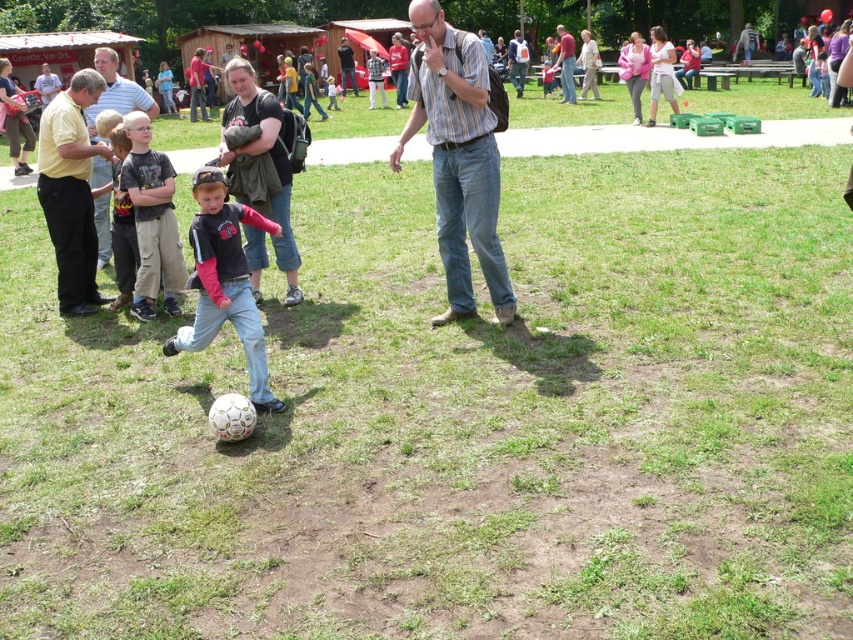
Question: Which point is closer to the camera taking this photo?

Choices:
 (A) (143, 108)
 (B) (236, 196)
 (C) (138, 129)

Answer: (C)

Question: Is dark gray cotton shirt at center above matte gray shirt at center?

Choices:
 (A) yes
 (B) no

Answer: (B)

Question: Estimate the real-world distances between objects in this image. Which object is farther from the matte gray shirt at center?

Choices:
 (A) matte black shirt at center
 (B) matte black backpack at center
 (C) striped cotton shirt at center

Answer: (A)

Question: Which of the following is the farthest from the observer?

Choices:
 (A) (239, 116)
 (B) (196, 241)

Answer: (A)

Question: Does matte black shirt at left have a larger size compared to matte gray backpack at center?

Choices:
 (A) no
 (B) yes

Answer: (A)

Question: Can you confirm if matte black shirt at center is wider than matte yellow shirt at left?

Choices:
 (A) no
 (B) yes

Answer: (B)